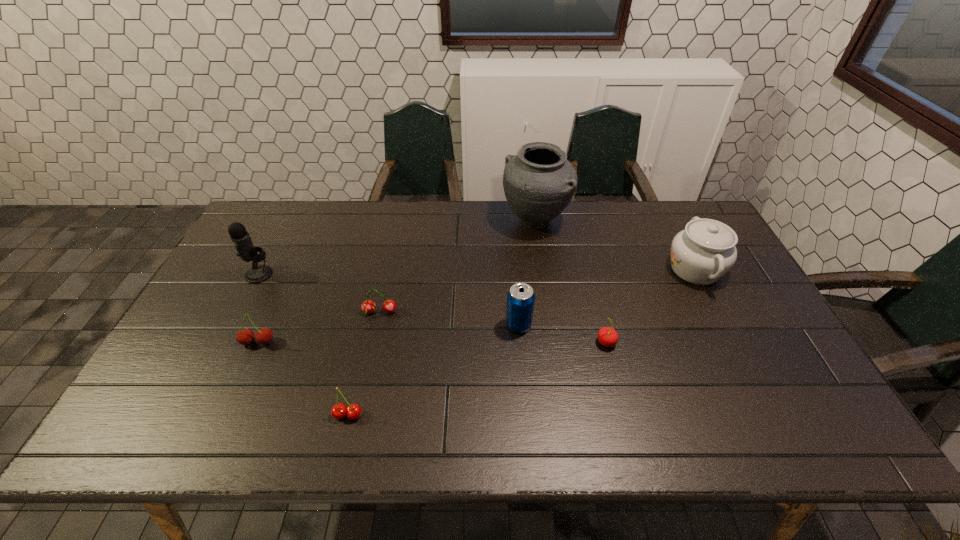
The height and width of the screenshot is (540, 960). What are the coordinates of `vacant point that satisfies the following two spatial constraints: 1. on the back side of the rightmost cherry; 2. on the left side of the third tallest object` in the screenshot? It's located at (588, 269).

I want to click on free space in the image that satisfies the following two spatial constraints: 1. on the surface of the rightmost cherry; 2. on the right side of the fifth tallest object, so (258, 342).